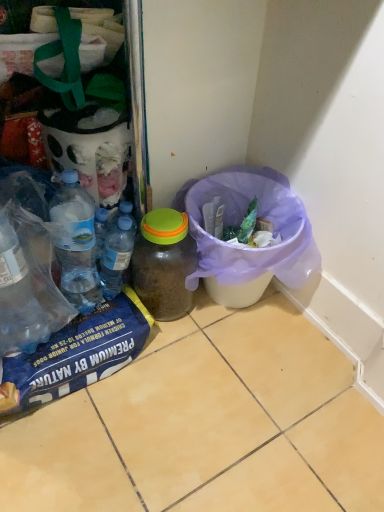
Question: Should I look upward or downward to see translucent plastic jar at center, acting as the first bottle starting from the right?

Choices:
 (A) up
 (B) down

Answer: (B)

Question: From a real-world perspective, is purple fabric bag at lower right below translucent plastic jar at center, positioned as the 2th bottle in left-to-right order?

Choices:
 (A) yes
 (B) no

Answer: (A)

Question: Could you tell me if purple fabric bag at lower right is facing translucent plastic jar at center, acting as the first bottle starting from the right?

Choices:
 (A) yes
 (B) no

Answer: (B)

Question: Does purple fabric bag at lower right lie behind translucent plastic jar at center, acting as the first bottle starting from the right?

Choices:
 (A) yes
 (B) no

Answer: (B)

Question: From the image's perspective, does purple fabric bag at lower right appear higher than translucent plastic jar at center, acting as the first bottle starting from the right?

Choices:
 (A) no
 (B) yes

Answer: (B)

Question: Is purple fabric bag at lower right to the right of translucent plastic jar at center, acting as the first bottle starting from the right, from the viewer's perspective?

Choices:
 (A) no
 (B) yes

Answer: (B)

Question: Is purple fabric bag at lower right positioned in front of translucent plastic jar at center, positioned as the 2th bottle in left-to-right order?

Choices:
 (A) no
 (B) yes

Answer: (B)

Question: Considering the relative sizes of translucent plastic jar at center, positioned as the 2th bottle in left-to-right order, and purple fabric bag at lower right in the image provided, is translucent plastic jar at center, positioned as the 2th bottle in left-to-right order, shorter than purple fabric bag at lower right?

Choices:
 (A) yes
 (B) no

Answer: (A)

Question: Is translucent plastic jar at center, acting as the first bottle starting from the right, not close to purple fabric bag at lower right?

Choices:
 (A) no
 (B) yes

Answer: (A)

Question: Does translucent plastic jar at center, acting as the first bottle starting from the right, have a greater width compared to purple fabric bag at lower right?

Choices:
 (A) yes
 (B) no

Answer: (B)

Question: Does translucent plastic jar at center, acting as the first bottle starting from the right, have a larger size compared to purple fabric bag at lower right?

Choices:
 (A) no
 (B) yes

Answer: (A)

Question: Is translucent plastic jar at center, positioned as the 2th bottle in left-to-right order, outside of purple fabric bag at lower right?

Choices:
 (A) yes
 (B) no

Answer: (A)

Question: Is translucent plastic jar at center, acting as the first bottle starting from the right, beside purple fabric bag at lower right?

Choices:
 (A) yes
 (B) no

Answer: (B)

Question: From a real-world perspective, does purple fabric bag at lower right stand above translucent plastic bottles at center, which ranks as the first bottle in left-to-right order?

Choices:
 (A) yes
 (B) no

Answer: (B)